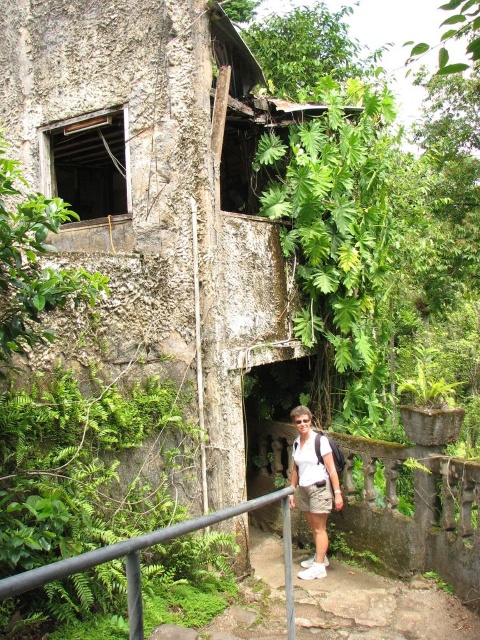
Between brown stone steps at center and black metal/rail at lower center, which one has more height?

black metal/rail at lower center is taller.

Does brown stone steps at center have a greater height compared to black metal/rail at lower center?

Incorrect, brown stone steps at center's height is not larger of black metal/rail at lower center's.

Which is in front, point (254, 568) or point (117, 545)?

Point (117, 545)

The width and height of the screenshot is (480, 640). I want to click on brown stone steps at center, so click(379, 608).

Describe the element at coordinates (151, 545) in the screenshot. I see `black metal/rail at lower center` at that location.

Which is below, black metal/rail at lower center or white cotton shirt at center?

white cotton shirt at center

The height and width of the screenshot is (640, 480). I want to click on black metal/rail at lower center, so click(151, 545).

Where is `black metal/rail at lower center`? The width and height of the screenshot is (480, 640). black metal/rail at lower center is located at coordinates coord(151,545).

Which of these two, brown stone steps at center or white cotton shirt at center, stands taller?

white cotton shirt at center

Can you confirm if brown stone steps at center is positioned to the left of white cotton shirt at center?

Incorrect, brown stone steps at center is not on the left side of white cotton shirt at center.

Locate an element on the screen. brown stone steps at center is located at coordinates (379, 608).